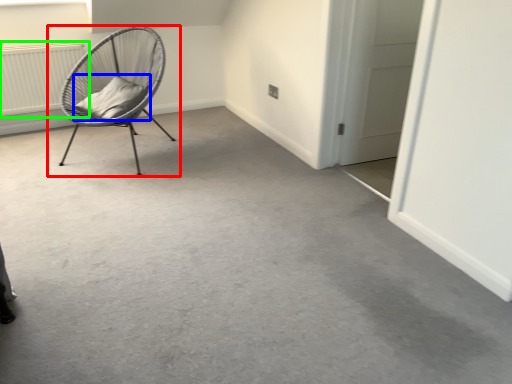
Question: Which object is the closest to the chair (highlighted by a red box)? Choose among these: pillow (highlighted by a blue box) or radiator (highlighted by a green box).

Choices:
 (A) pillow
 (B) radiator

Answer: (A)